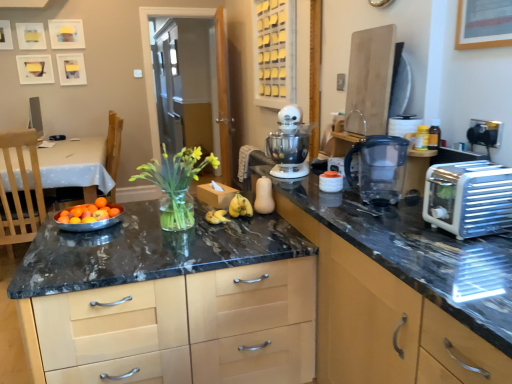
At what (x,y) coordinates should I click in order to perform the action: click on free space in front of transparent plastic pitcher at right. Please return your answer as a coordinate pair (x, y). The image size is (512, 384). Looking at the image, I should click on (369, 215).